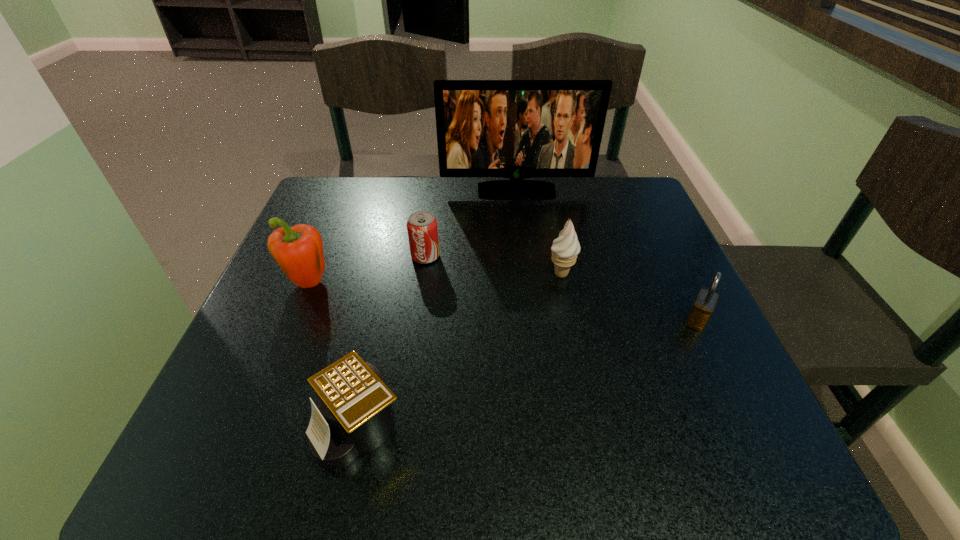
Find the location of a particular element. free space between the monitor and the calculator is located at coordinates (438, 308).

This screenshot has width=960, height=540. Find the location of `vacant area that lies between the leftmost object and the soda can`. vacant area that lies between the leftmost object and the soda can is located at coordinates (367, 271).

The height and width of the screenshot is (540, 960). Find the location of `vacant area that lies between the padlock and the soda can`. vacant area that lies between the padlock and the soda can is located at coordinates (562, 288).

The image size is (960, 540). Find the location of `vacant region between the icecream and the monitor`. vacant region between the icecream and the monitor is located at coordinates (539, 232).

You are a GUI agent. You are given a task and a screenshot of the screen. Output one action in this format:
    pyautogui.click(x=<x>, y=<y>)
    Task: Click on the free space between the soda can and the fifth farthest object
    
    Given the screenshot: What is the action you would take?
    pyautogui.click(x=562, y=288)

The image size is (960, 540). Identify the location of vacant area between the second nearest object and the third tallest object. (629, 297).

Find the location of `free space between the icecream and the soda can`. free space between the icecream and the soda can is located at coordinates (493, 265).

Image resolution: width=960 pixels, height=540 pixels. Identify the location of free space between the nearest object and the farthest object. (438, 308).

Select which object appears as the closest to the pepper. Please provide its 2D coordinates. Your answer should be formatted as a tuple, i.e. [(x, y)], where the tuple contains the x and y coordinates of a point satisfying the conditions above.

[(422, 229)]

Where is `the fourth closest object relative to the rightmost object`? The width and height of the screenshot is (960, 540). the fourth closest object relative to the rightmost object is located at coordinates (353, 416).